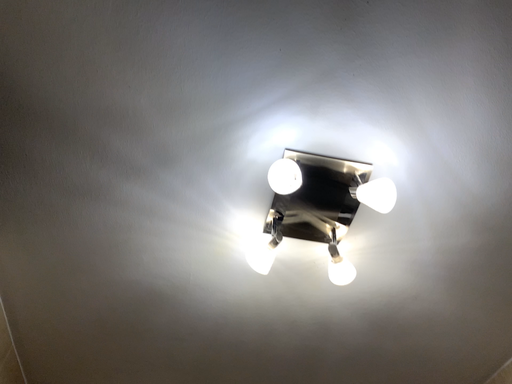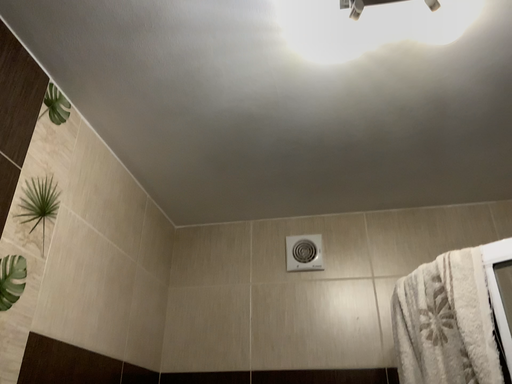
Question: Which way did the camera rotate in the video?

Choices:
 (A) rotated left
 (B) rotated right

Answer: (A)